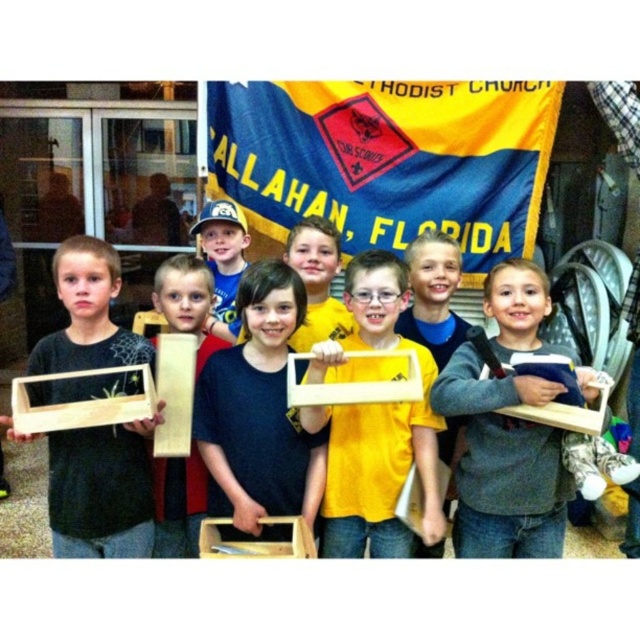
Question: Does matte wood frame at center appear on the left side of matte black cap at center?

Choices:
 (A) yes
 (B) no

Answer: (B)

Question: Which of the following is the farthest from the observer?

Choices:
 (A) (209, 435)
 (B) (211, 314)

Answer: (B)

Question: Does matte wood frame at center appear on the right side of matte black shirt at center?

Choices:
 (A) no
 (B) yes

Answer: (B)

Question: Which object is closer to the camera taking this photo?

Choices:
 (A) gray matte wooden crate at center
 (B) matte wood box at left

Answer: (B)

Question: Based on their relative distances, which object is nearer to the matte wood box at left?

Choices:
 (A) matte black cap at center
 (B) light brown wood at center
 (C) matte black shirt at center

Answer: (B)

Question: Observing the image, what is the correct spatial positioning of matte wood frame at center in reference to matte black cap at center?

Choices:
 (A) right
 (B) left

Answer: (A)